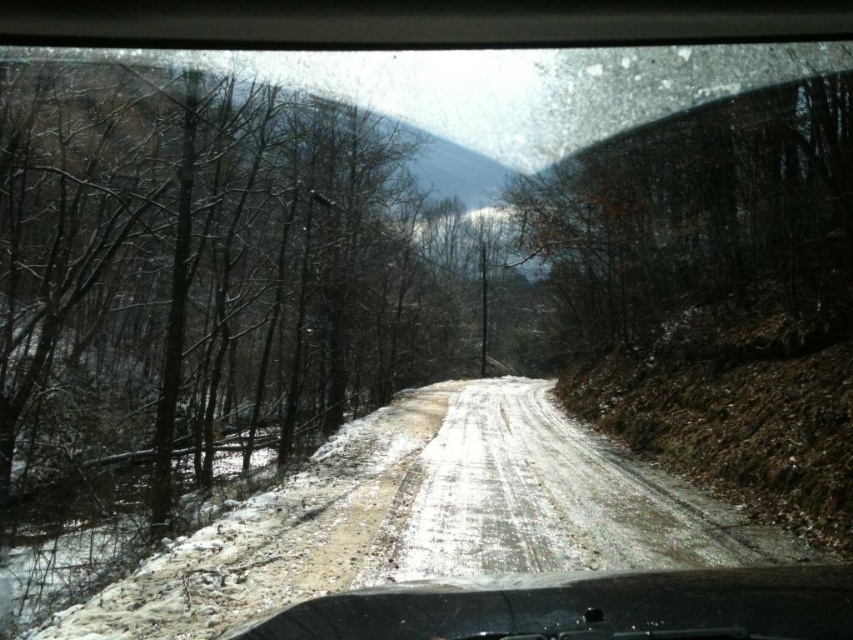
Question: Does sandy dirt road at center have a larger size compared to black rubber dashboard at bottom?

Choices:
 (A) yes
 (B) no

Answer: (A)

Question: In this image, where is smooth bark tree at left located relative to brown matte tree at upper right?

Choices:
 (A) right
 (B) left

Answer: (B)

Question: Which object is positioned farthest from the black rubber dashboard at bottom?

Choices:
 (A) sandy dirt road at center
 (B) smooth bark tree at left
 (C) brown matte tree at upper right

Answer: (B)

Question: Which point is farther to the camera?

Choices:
 (A) (202, 410)
 (B) (850, 198)
 (C) (431, 602)
 (D) (728, 548)

Answer: (A)

Question: Is sandy dirt road at center thinner than black rubber dashboard at bottom?

Choices:
 (A) yes
 (B) no

Answer: (A)

Question: Which is nearer to the brown matte tree at upper right?

Choices:
 (A) black rubber dashboard at bottom
 (B) sandy dirt road at center
 (C) smooth bark tree at left

Answer: (B)